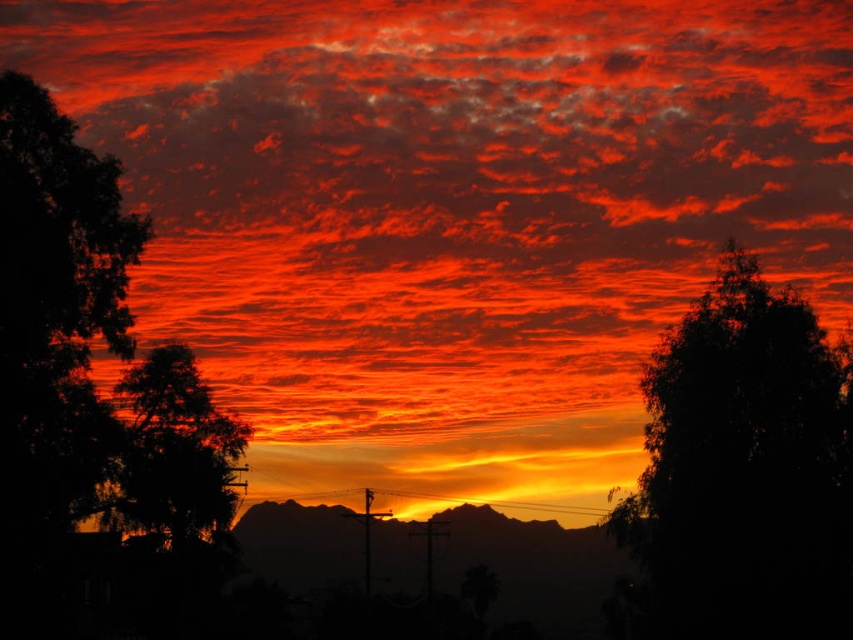
Question: Does silky dark green tree at upper right appear on the right side of silhouette tree at left?

Choices:
 (A) no
 (B) yes

Answer: (B)

Question: Is silky dark green tree at upper right to the right of silhouette tree at left from the viewer's perspective?

Choices:
 (A) yes
 (B) no

Answer: (A)

Question: Can you confirm if silky dark green tree at upper right is positioned to the left of silhouette tree at left?

Choices:
 (A) no
 (B) yes

Answer: (A)

Question: Which point is farther to the camera?

Choices:
 (A) (213, 460)
 (B) (752, 401)

Answer: (A)

Question: Which object is closer to the camera taking this photo?

Choices:
 (A) silhouette tree at left
 (B) silky dark green tree at upper right

Answer: (B)

Question: Which point is closer to the camera taking this photo?

Choices:
 (A) (686, 324)
 (B) (171, 499)

Answer: (A)